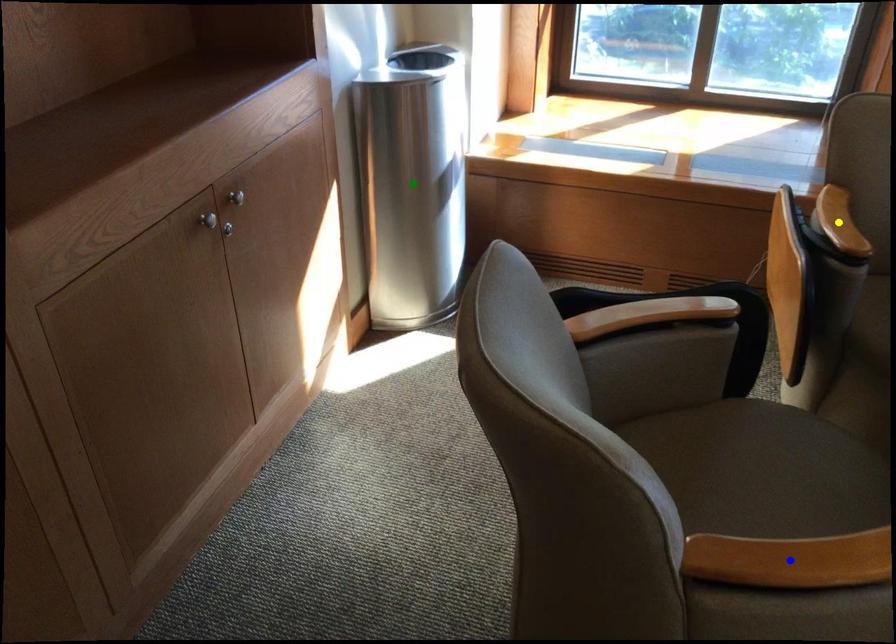
Order these from nearest to farthest:
blue point
green point
yellow point

green point, yellow point, blue point